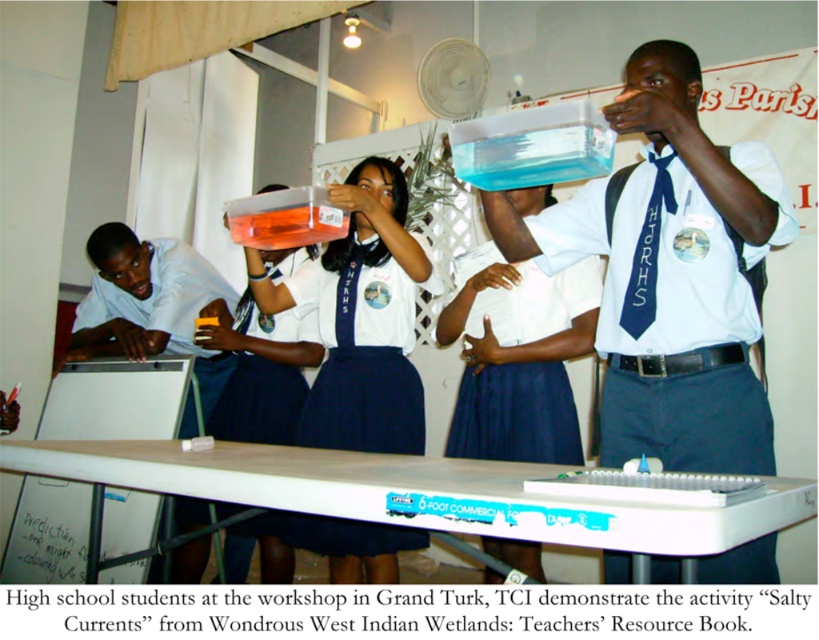
Question: Does white fabric shirt at upper center have a greater width compared to white fabric shirt at center?

Choices:
 (A) yes
 (B) no

Answer: (A)

Question: Is white fabric shirt at upper center thinner than white fabric shirt at center?

Choices:
 (A) yes
 (B) no

Answer: (B)

Question: Can you confirm if white fabric shirt at upper center is wider than white fabric shirt at center?

Choices:
 (A) yes
 (B) no

Answer: (A)

Question: Which point is closer to the camera taking this photo?

Choices:
 (A) (306, 435)
 (B) (754, 396)

Answer: (B)